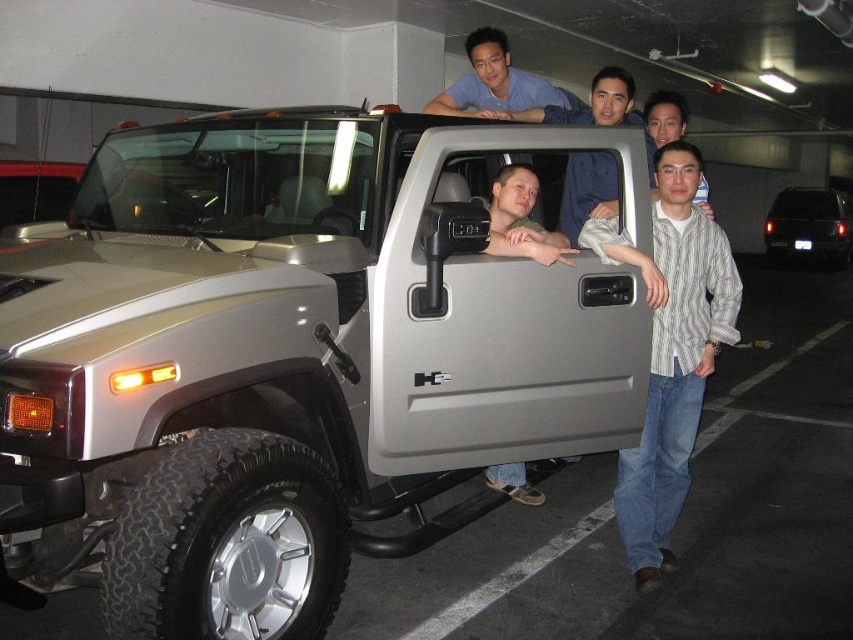
You are a photographer trying to capture a photo of the matte gray shirt at center and the black glossy suv at right. Since you want to emphasize both objects equally in the frame, which one should you zoom in on more to balance their sizes?

Since the matte gray shirt at center is smaller than the black glossy suv at right, you should zoom in more on the matte gray shirt at center to make it appear larger in the photo and balance their sizes.

You are a photographer trying to capture a clear photo of the matte gray shirt at center and the black glossy suv at right. Since you want both subjects in focus, which one should you focus on first to ensure depth of field covers both?

You should focus on the matte gray shirt at center first because it is closer to the viewer than the black glossy suv at right. By focusing on the closer object, the depth of field will extend backward to include the suv.